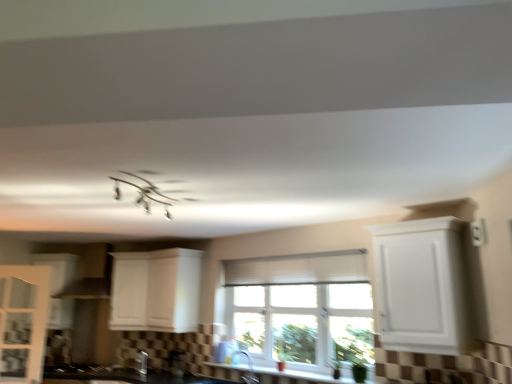
Question: Considering the positions of metallic stainless steel toaster at lower center, which appears as the 1th appliance when viewed from the right, and white matte cabinet at center, arranged as the 2th cabinetry when viewed from the right, in the image, is metallic stainless steel toaster at lower center, which appears as the 1th appliance when viewed from the right, taller or shorter than white matte cabinet at center, arranged as the 2th cabinetry when viewed from the right,?

Choices:
 (A) short
 (B) tall

Answer: (A)

Question: Looking at their shapes, would you say metallic stainless steel toaster at lower center, the second appliance when ordered from left to right, is wider or thinner than white matte cabinet at center, the fourth cabinetry from the left?

Choices:
 (A) thin
 (B) wide

Answer: (A)

Question: Considering the real-world distances, which object is farthest from the black matte gas stove at lower left?

Choices:
 (A) white matte cabinet at center, arranged as the 2th cabinetry when viewed from the right
 (B) white ceramic window sill at lower center
 (C) white glossy cabinet at left, the 4th cabinetry in the right-to-left sequence
 (D) metallic stainless steel toaster at lower center, the second appliance when ordered from left to right
 (E) black glossy countertop at lower center

Answer: (B)

Question: Which is farther from the satin nickel faucet at lower center?

Choices:
 (A) white plastic window at center
 (B) black glossy countertop at lower center
 (C) metallic stainless steel toaster at lower center, the second appliance when ordered from left to right
 (D) white matte cabinet at right, the 5th cabinetry from the left
 (E) black matte gas stove at lower left

Answer: (D)